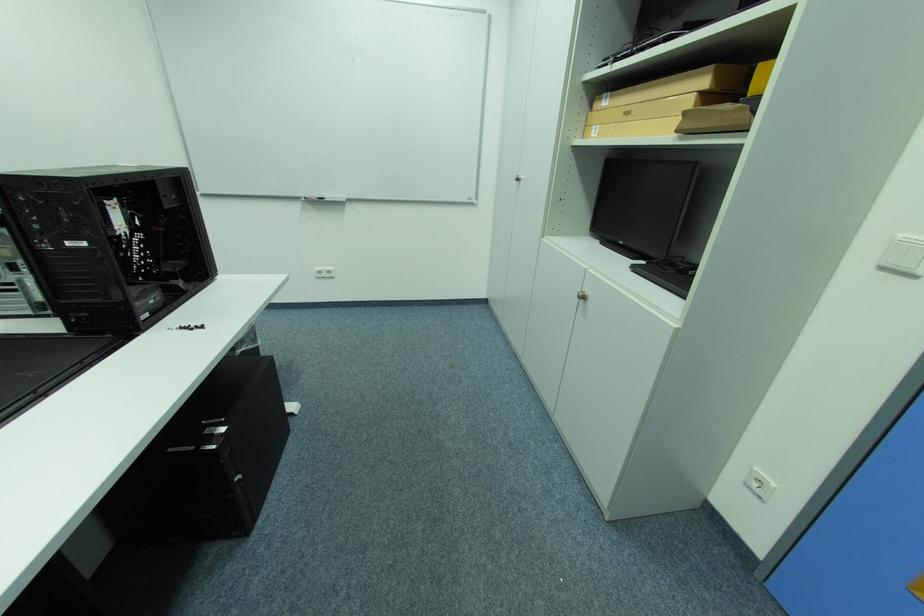
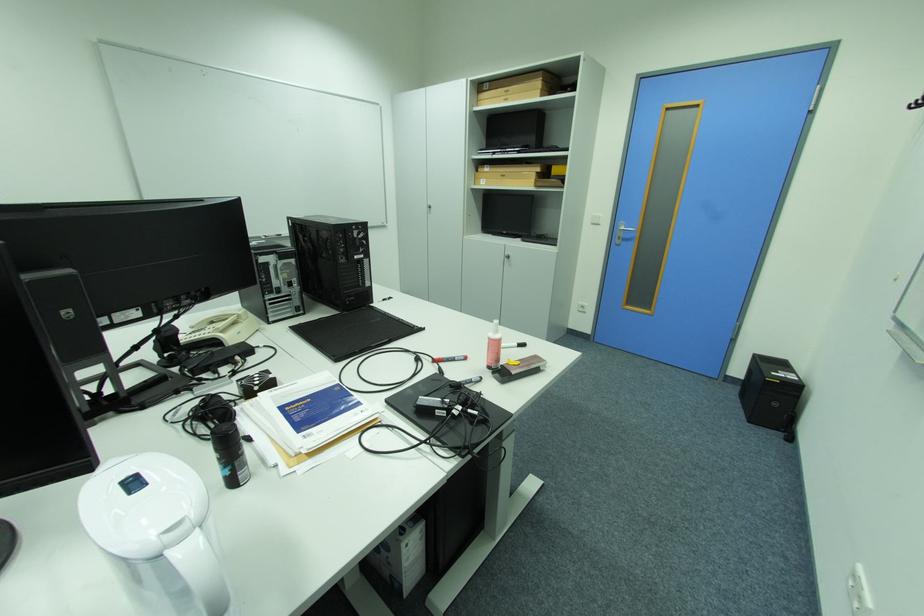
Question: I am providing you with two images of the same scene from different viewpoints. Which of the following objects are not visible in image2?

Choices:
 (A) red marker
 (B) white fluid bottle
 (C) black marker
 (D) none of these

Answer: (D)